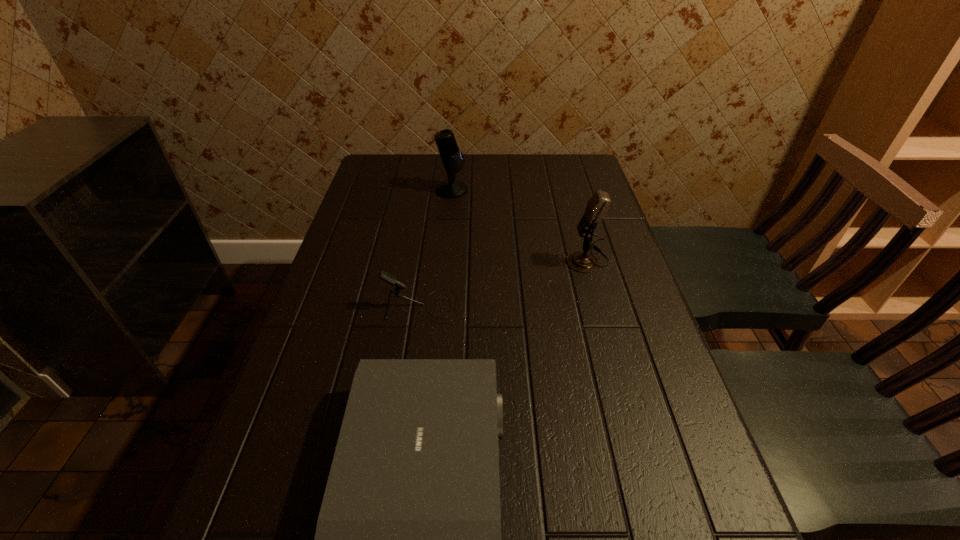
The image size is (960, 540). What are the coordinates of `object that can be found as the closest to the rightmost object` in the screenshot? It's located at (389, 278).

The image size is (960, 540). I want to click on microphone that is the second closest one to the shortest microphone, so click(452, 158).

The width and height of the screenshot is (960, 540). In order to click on microphone object that ranks as the third closest to the nearest object in this screenshot , I will do `click(452, 158)`.